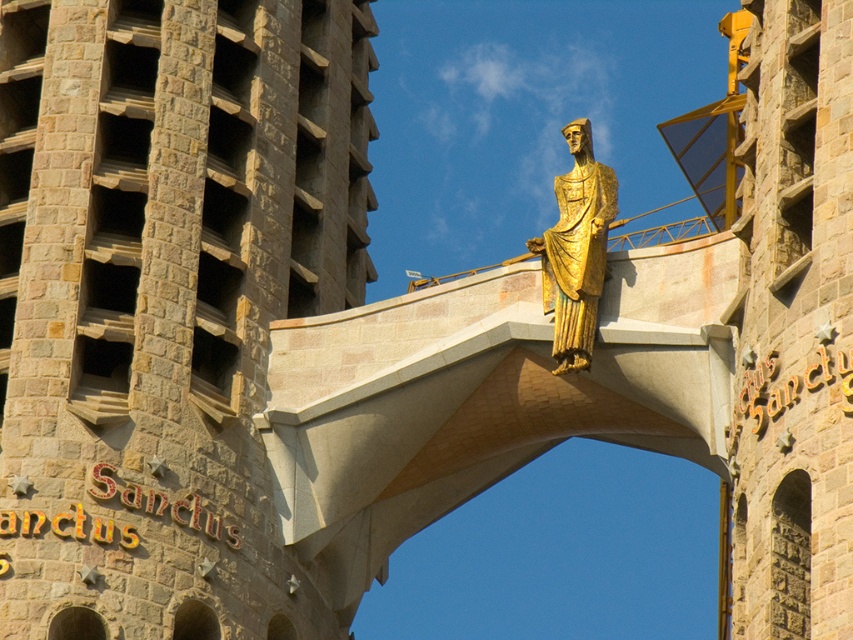
Question: Is beige stone tower at center behind gold polished statue at upper center?

Choices:
 (A) no
 (B) yes

Answer: (A)

Question: Observing the image, what is the correct spatial positioning of beige stone tower at center in reference to gold polished statue at upper center?

Choices:
 (A) below
 (B) above

Answer: (A)

Question: Where is beige stone tower at center located in relation to gold polished statue at upper center in the image?

Choices:
 (A) above
 (B) below

Answer: (B)

Question: Among these objects, which one is farthest from the camera?

Choices:
 (A) gold polished statue at upper center
 (B) beige stone tower at center

Answer: (A)